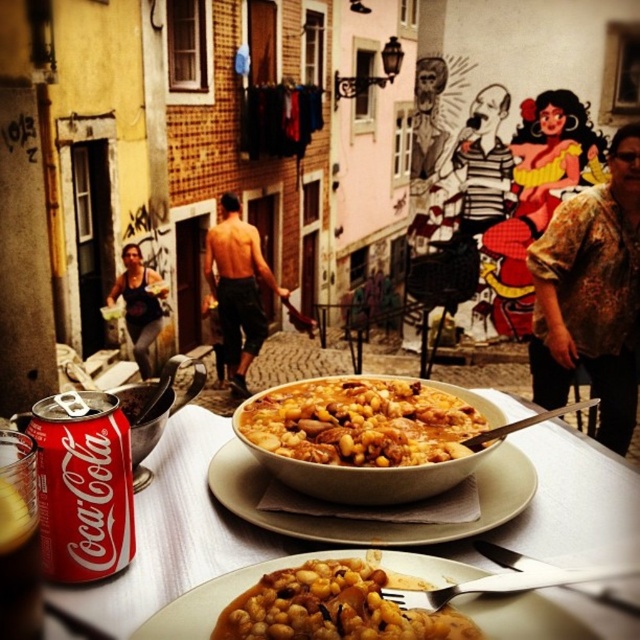
You are a chef preparing a dish and need to place both the matte brown beans at center and the matte black tank top at center on a small shelf. Given that the shelf can only hold items that are no larger than the size of a standard coffee mug, will both items fit?

The matte brown beans at center is smaller than the matte black tank top at center. Since the matte black tank top at center is larger than the matte brown beans at center, and the shelf can only hold items up to the size of a standard coffee mug, it depends on the size of the matte black tank top at center. If the matte black tank top at center is larger than a coffee mug, it won

You are a food delivery person who needs to place a small container on the table where the matte brown beans at center and the matte black tank top at center are located. Where should you place the container so that it doesn not block either object?

The matte brown beans at center is below the matte black tank top at center, so placing the container between them would block both. Instead, place it either above the matte black tank top at center or below the matte brown beans at center to avoid blocking either object.